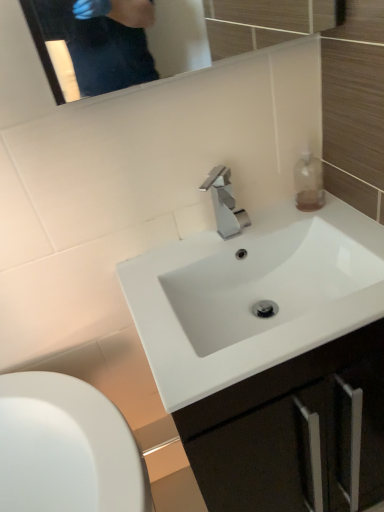
The width and height of the screenshot is (384, 512). What are the coordinates of `vacant area situated to the left side of translucent glass bottle at upper right` in the screenshot? It's located at (263, 224).